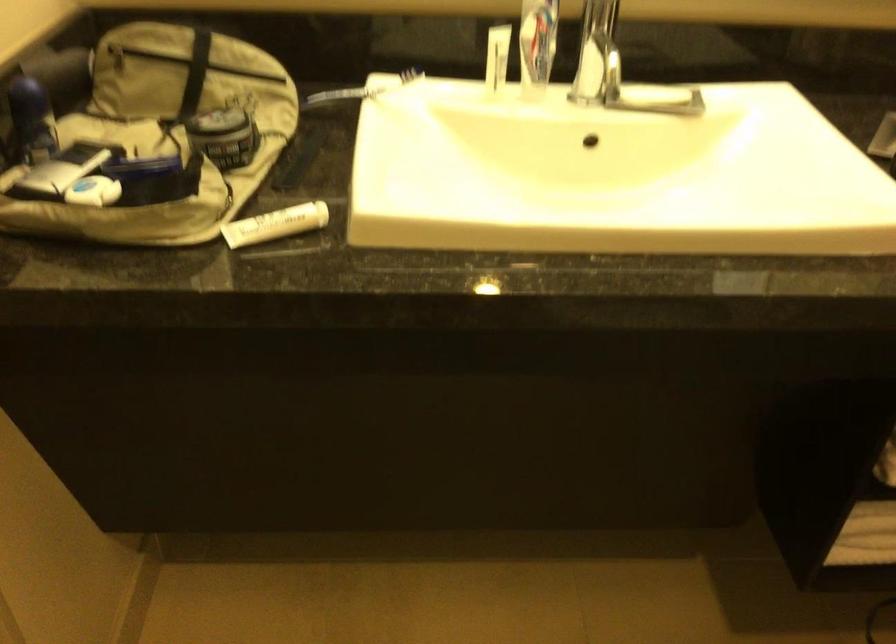
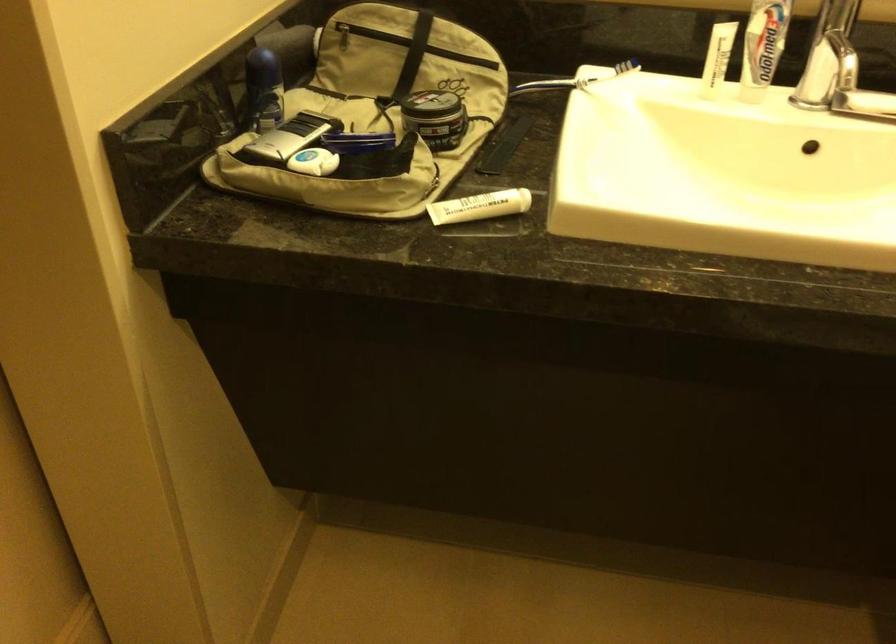
Question: The first image is from the beginning of the video and the second image is from the end. How did the camera likely rotate when shooting the video?

Choices:
 (A) Left
 (B) Right
 (C) Up
 (D) Down

Answer: (A)